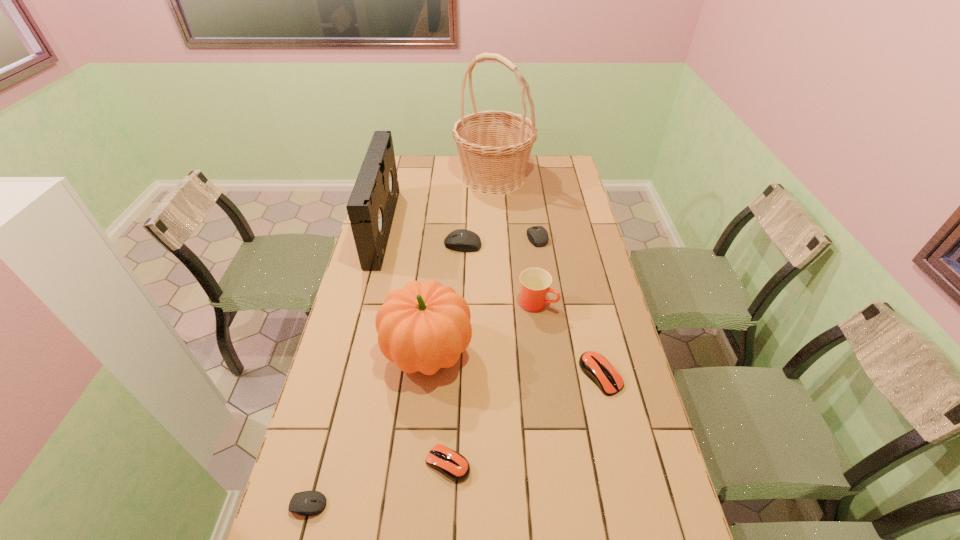
You are a GUI agent. You are given a task and a screenshot of the screen. Output one action in this format:
    pyautogui.click(x=<x>, y=<y>)
    Task: Click on the basket
    
    Given the screenshot: What is the action you would take?
    pyautogui.click(x=494, y=147)

You are a GUI agent. You are given a task and a screenshot of the screen. Output one action in this format:
    pyautogui.click(x=<x>, y=<y>)
    Task: Click on the gray videotape
    This screenshot has height=540, width=960.
    Given the screenshot: What is the action you would take?
    pyautogui.click(x=371, y=207)

This screenshot has width=960, height=540. Identify the location of videotape. [371, 207].

The height and width of the screenshot is (540, 960). What are the coordinates of `orange pumpkin` in the screenshot? It's located at (423, 327).

Identify the location of the third tallest object. The height and width of the screenshot is (540, 960). (423, 327).

The height and width of the screenshot is (540, 960). Find the location of `the fourth tallest object`. the fourth tallest object is located at coordinates (535, 282).

Locate an element on the screen. This screenshot has height=540, width=960. the fifth farthest object is located at coordinates (535, 282).

The image size is (960, 540). Find the location of `the fifth tallest object`. the fifth tallest object is located at coordinates (462, 240).

I want to click on the biggest black computer equipment, so click(462, 240).

The image size is (960, 540). Identify the location of the rightmost computer equipment. (595, 366).